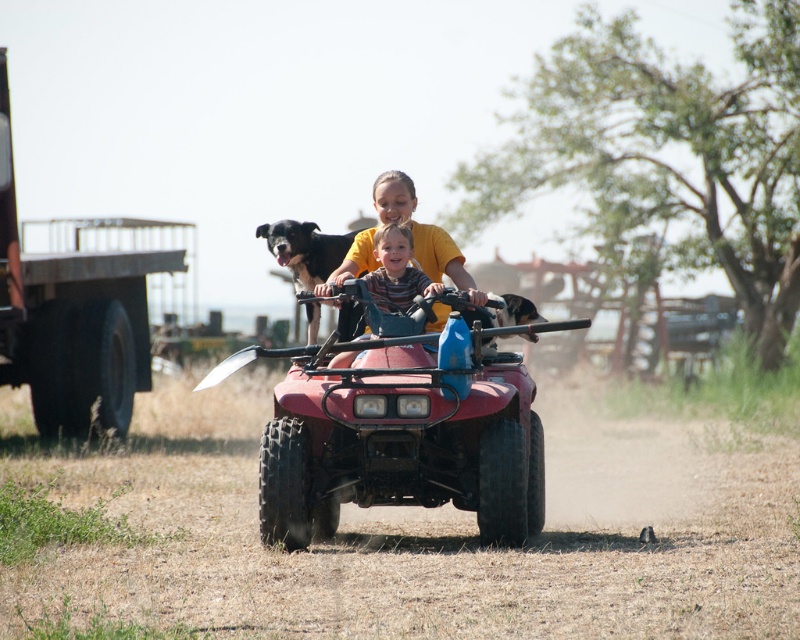
You are a photographer trying to capture the black fur dog at center and the dusty terrain at center in a single shot. Based on their positions, will the dog be visible above or below the dusty terrain in the photo?

The dusty terrain at center is below the black fur dog at center, so the dog will be visible above the dusty terrain in the photo.

You are a drone operator trying to capture a photo of the two children riding the red four wheeler. The drone is currently hovering at point (420, 531) which is the dusty terrain at center. To get a clear shot of the children, should you move the drone north or south?

The point (420, 531) indicates dusty terrain at center, so moving the drone north would position it closer to the children riding the red four wheeler at the center, providing a clearer shot.